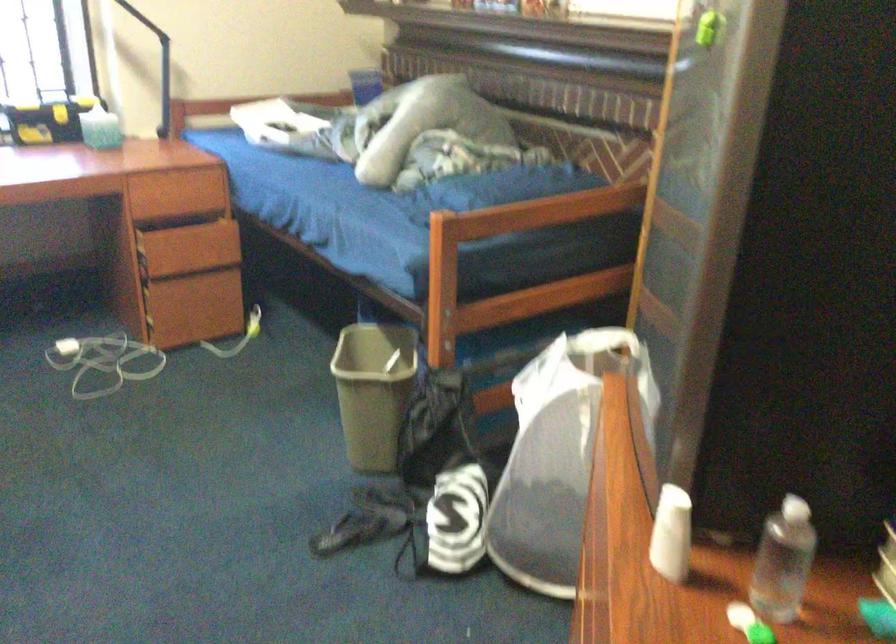
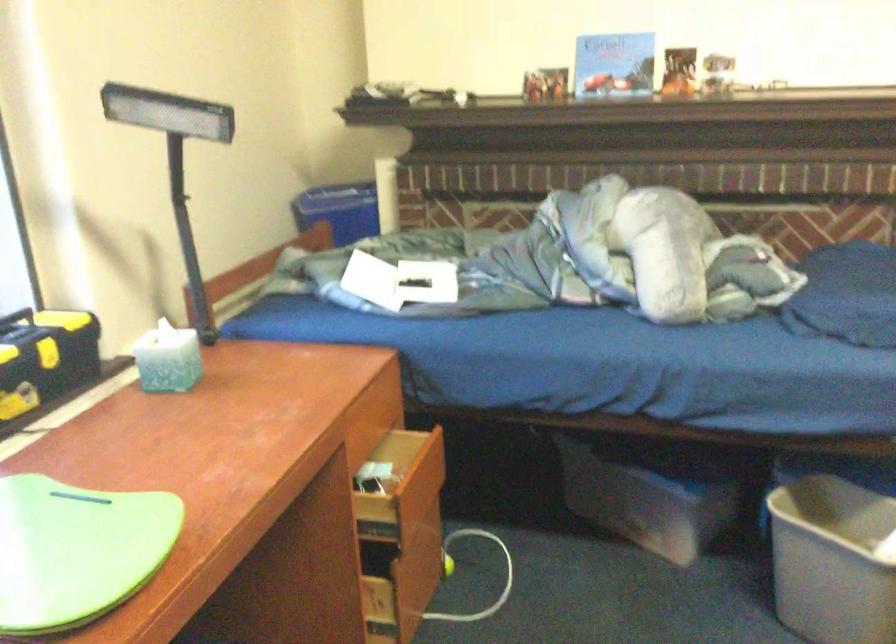
Locate, in the second image, the point that corresponds to [207,307] in the first image.

(420, 569)